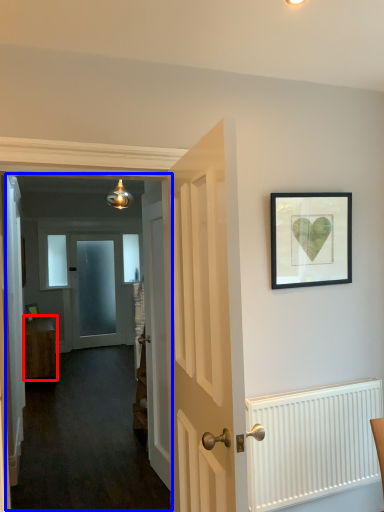
Question: Which object appears farthest to the camera in this image, furniture (highlighted by a red box) or corridor (highlighted by a blue box)?

Choices:
 (A) furniture
 (B) corridor

Answer: (A)